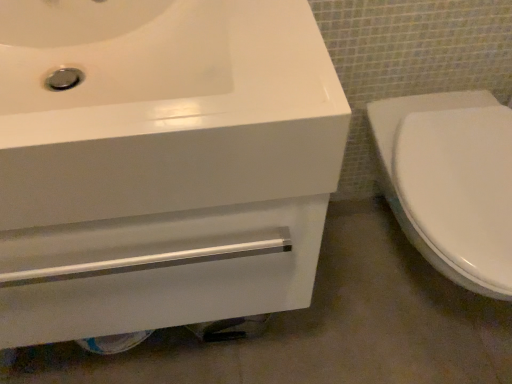
This screenshot has height=384, width=512. I want to click on free region under white glossy toilet at right (from a real-world perspective), so click(x=421, y=291).